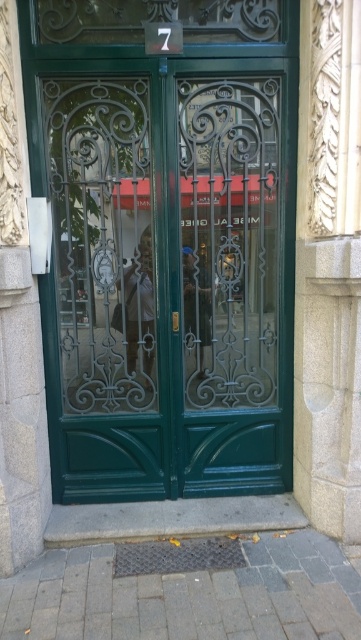
Question: Which is nearer to the green glass screen door at center?

Choices:
 (A) smooth leather jacket at center
 (B) green wrought iron screen door at center

Answer: (B)

Question: Does matte white shirt at center have a greater width compared to smooth leather jacket at center?

Choices:
 (A) no
 (B) yes

Answer: (B)

Question: Estimate the real-world distances between objects in this image. Which object is farther from the green glass screen door at center?

Choices:
 (A) matte white shirt at center
 (B) green wrought iron screen door at center
 (C) smooth leather jacket at center

Answer: (C)

Question: Which of these objects is positioned closest to the green glass screen door at center?

Choices:
 (A) green wrought iron screen door at center
 (B) smooth leather jacket at center
 (C) matte white shirt at center

Answer: (C)

Question: Can you confirm if matte white shirt at center is smaller than smooth leather jacket at center?

Choices:
 (A) yes
 (B) no

Answer: (B)

Question: Does green glass screen door at center have a lesser width compared to matte white shirt at center?

Choices:
 (A) no
 (B) yes

Answer: (A)